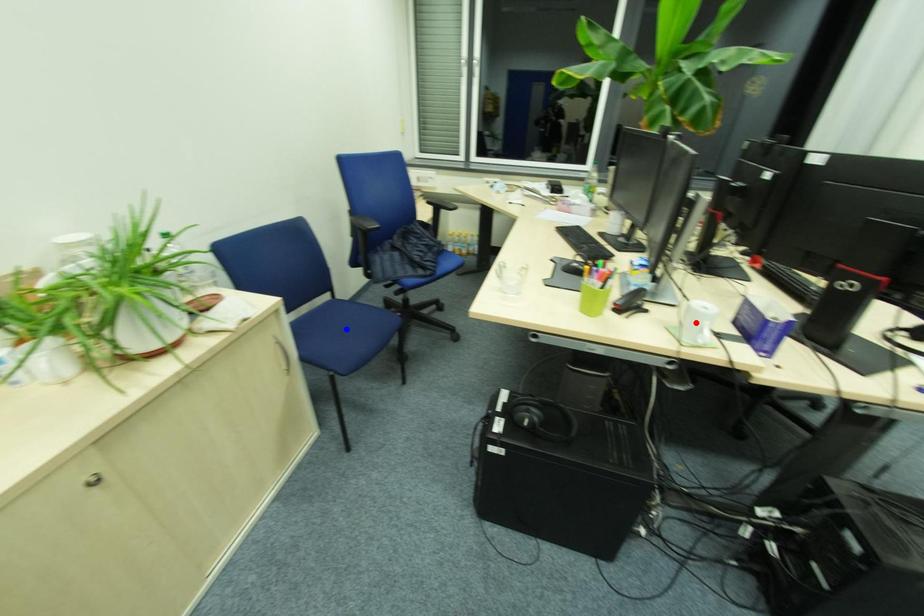
Question: In the image, two points are highlighted. Which point is nearer to the camera? Reply with the corresponding letter.

Choices:
 (A) blue point
 (B) red point

Answer: (B)